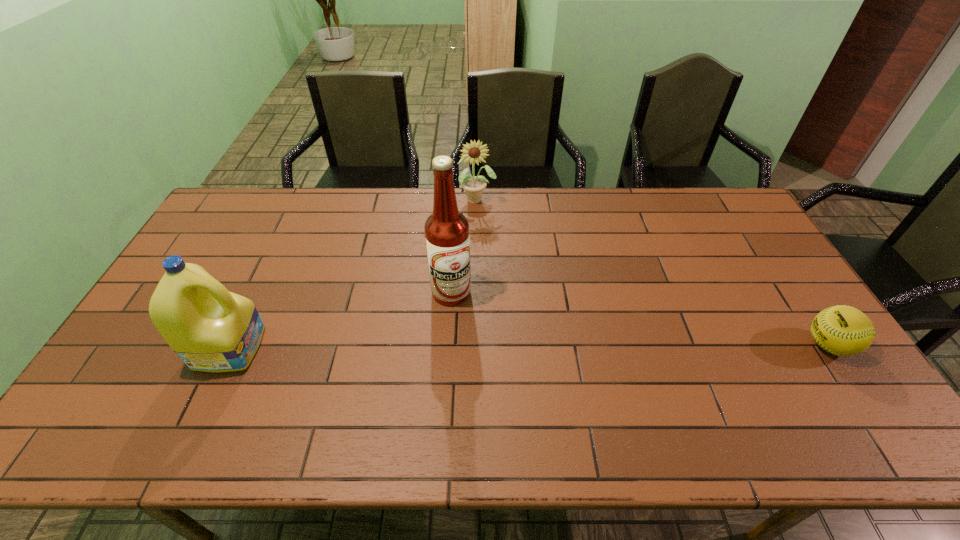
Select which object is the closest to the leftmost object. Please provide its 2D coordinates. Your answer should be formatted as a tuple, i.e. [(x, y)], where the tuple contains the x and y coordinates of a point satisfying the conditions above.

[(447, 236)]

Where is `the third closest object to the third shortest object`? The width and height of the screenshot is (960, 540). the third closest object to the third shortest object is located at coordinates (842, 330).

Where is `free location that satisfies the following two spatial constraints: 1. on the back side of the farthest object; 2. on the right side of the tallest object`? Image resolution: width=960 pixels, height=540 pixels. free location that satisfies the following two spatial constraints: 1. on the back side of the farthest object; 2. on the right side of the tallest object is located at coordinates (457, 199).

Identify the location of free region that satisfies the following two spatial constraints: 1. on the front side of the shortest object; 2. on the logo side of the sunflower. The image size is (960, 540). (475, 345).

I want to click on free region that satisfies the following two spatial constraints: 1. on the front side of the farthest object; 2. on the logo side of the shortest object, so pyautogui.click(x=475, y=345).